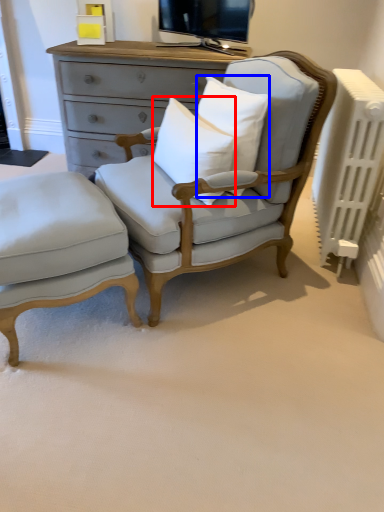
Question: Which point is closer to the camera, pillow (highlighted by a red box) or pillow (highlighted by a blue box)?

Choices:
 (A) pillow
 (B) pillow

Answer: (A)